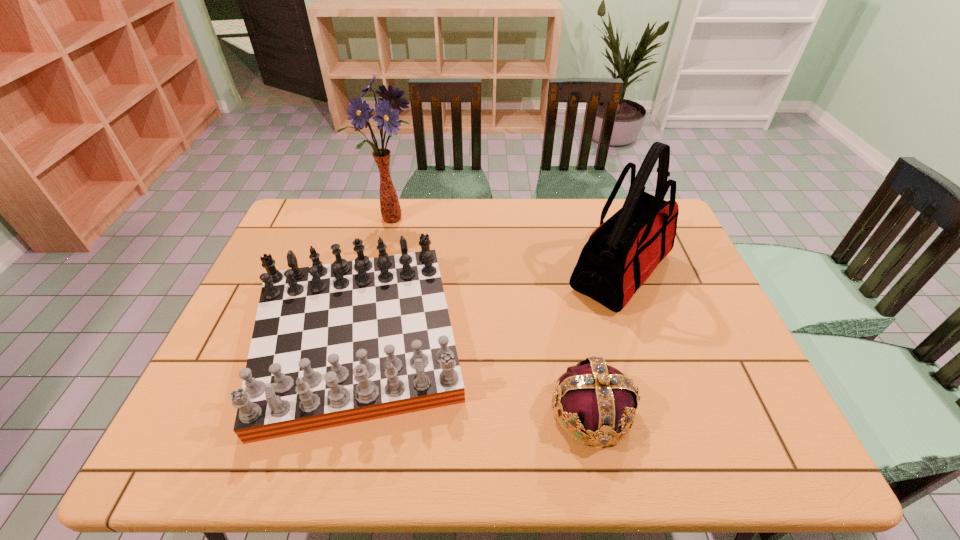
The image size is (960, 540). Identify the location of object identified as the second closest to the flower arrangement. (619, 256).

Locate an element on the screen. This screenshot has height=540, width=960. object that is the third nearest to the crown is located at coordinates (390, 208).

This screenshot has width=960, height=540. I want to click on vacant region that satisfies the following two spatial constraints: 1. on the front side of the crown; 2. on the left side of the gameboard, so 339,411.

Where is `free point that satisfies the following two spatial constraints: 1. on the back side of the duffel bag; 2. on the left side of the gameboard`? free point that satisfies the following two spatial constraints: 1. on the back side of the duffel bag; 2. on the left side of the gameboard is located at coordinates (374, 272).

Locate an element on the screen. The height and width of the screenshot is (540, 960). free point that satisfies the following two spatial constraints: 1. on the back side of the gameboard; 2. on the right side of the farthest object is located at coordinates coord(387,219).

Locate an element on the screen. vacant space that satisfies the following two spatial constraints: 1. on the back side of the duffel bag; 2. on the right side of the gameboard is located at coordinates (374, 272).